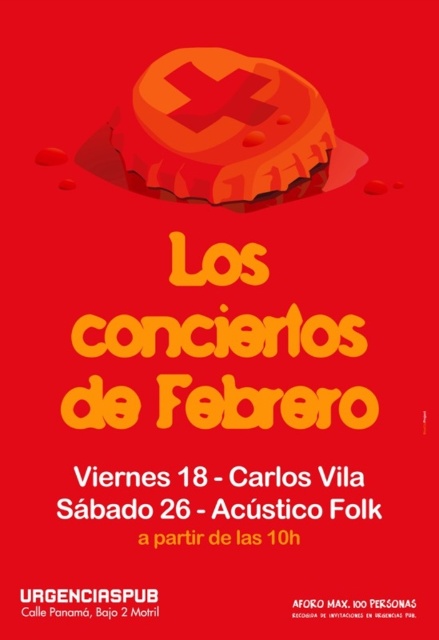
Based on the photo, is white paper text at center smaller than white paper at center?

No.

Between white paper text at center and white paper at center, which one appears on the right side from the viewer's perspective?

white paper at center

Is point (144, 604) positioned after point (349, 604)?

Yes, point (144, 604) is farther from viewer.

You are a GUI agent. You are given a task and a screenshot of the screen. Output one action in this format:
    pyautogui.click(x=<x>, y=<y>)
    Task: Click on the white paper text at center
    This screenshot has height=640, width=439.
    Given the screenshot: What is the action you would take?
    pyautogui.click(x=90, y=600)

Can you confirm if matte plastic bottle cap at upper center is positioned below white paper at center?

Incorrect, matte plastic bottle cap at upper center is not positioned below white paper at center.

Is point (277, 186) more distant than point (315, 616)?

Yes, it is behind point (315, 616).

Identify the location of matte plastic bottle cap at upper center. (223, 128).

Can you confirm if matte plastic bottle cap at upper center is positioned above white paper text at center?

Yes.

The width and height of the screenshot is (439, 640). Find the location of `matte plastic bottle cap at upper center`. matte plastic bottle cap at upper center is located at coordinates (223, 128).